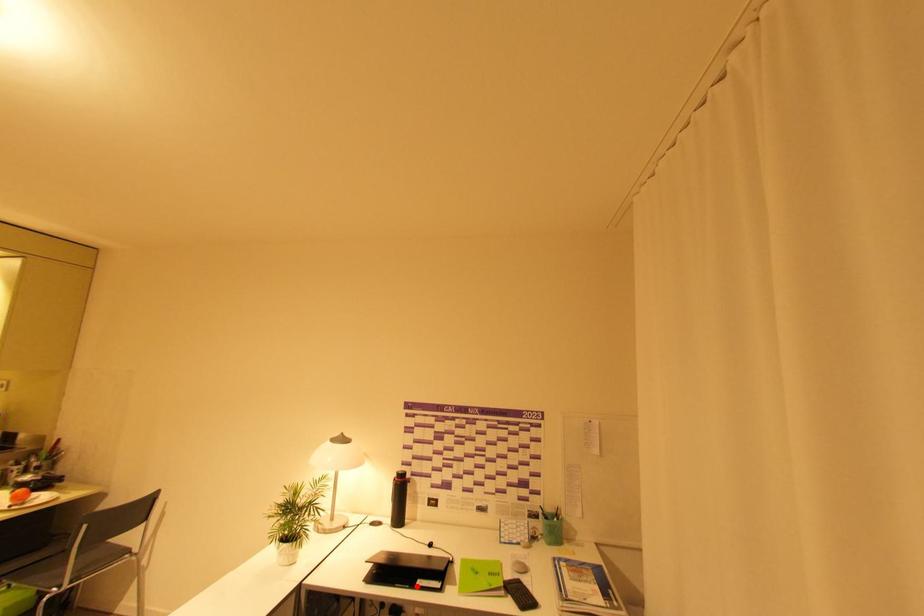
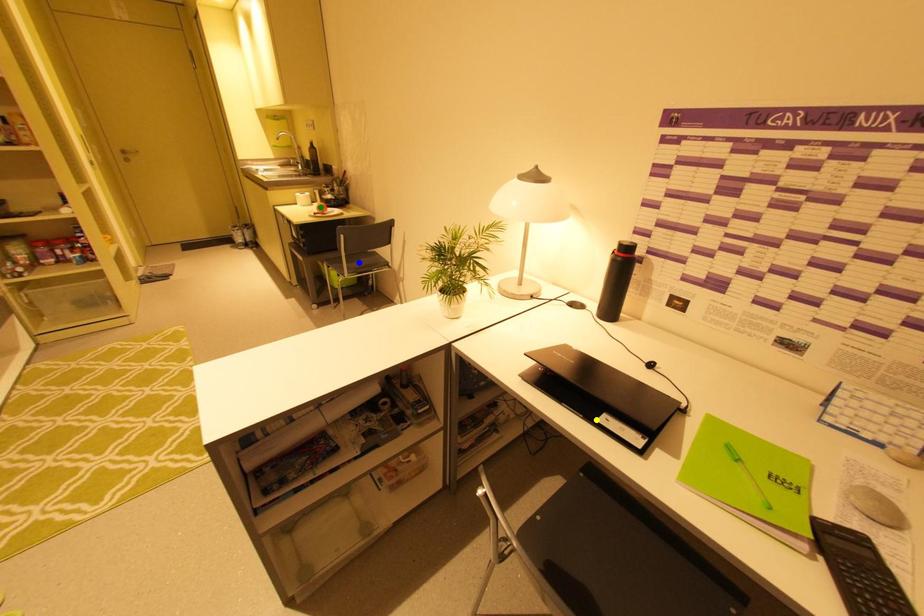
Question: I am providing you with two images of the same scene from different viewpoints. A red point is marked on the first image. You are given multiple points on the second image. Can you choose the point in image 2 that corresponds to the point in image 1?

Choices:
 (A) yellow point
 (B) blue point
 (C) green point

Answer: (A)